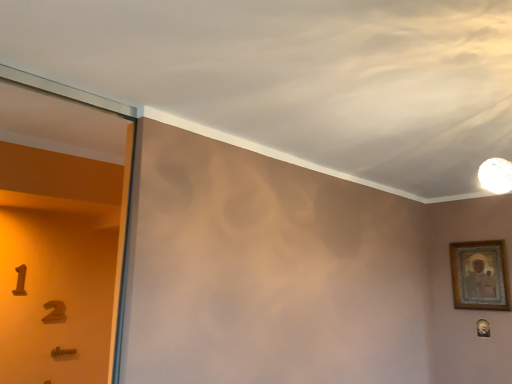
Question: Considering their positions, is gold-framed painting at right, the first picture frame from the top, located in front of or behind gold-framed portrait at lower right, placed as the 2th picture frame when sorted from top to bottom?

Choices:
 (A) front
 (B) behind

Answer: (A)

Question: Looking at the image, does gold-framed painting at right, which appears as the 2th picture frame when ordered from the bottom, seem bigger or smaller compared to gold-framed portrait at lower right, arranged as the 1th picture frame when ordered from the bottom?

Choices:
 (A) small
 (B) big

Answer: (B)

Question: Is point (500, 286) closer or farther from the camera than point (482, 327)?

Choices:
 (A) closer
 (B) farther

Answer: (A)

Question: Based on their positions, is gold-framed portrait at lower right, placed as the 2th picture frame when sorted from top to bottom, located to the left or right of gold-framed painting at right, the first picture frame from the top?

Choices:
 (A) left
 (B) right

Answer: (B)

Question: Looking at the image, does gold-framed portrait at lower right, placed as the 2th picture frame when sorted from top to bottom, seem bigger or smaller compared to gold-framed painting at right, the first picture frame from the top?

Choices:
 (A) small
 (B) big

Answer: (A)

Question: Is gold-framed portrait at lower right, placed as the 2th picture frame when sorted from top to bottom, taller or shorter than gold-framed painting at right, which appears as the 2th picture frame when ordered from the bottom?

Choices:
 (A) tall
 (B) short

Answer: (B)

Question: Does point (479, 322) appear closer or farther from the camera than point (497, 253)?

Choices:
 (A) farther
 (B) closer

Answer: (A)